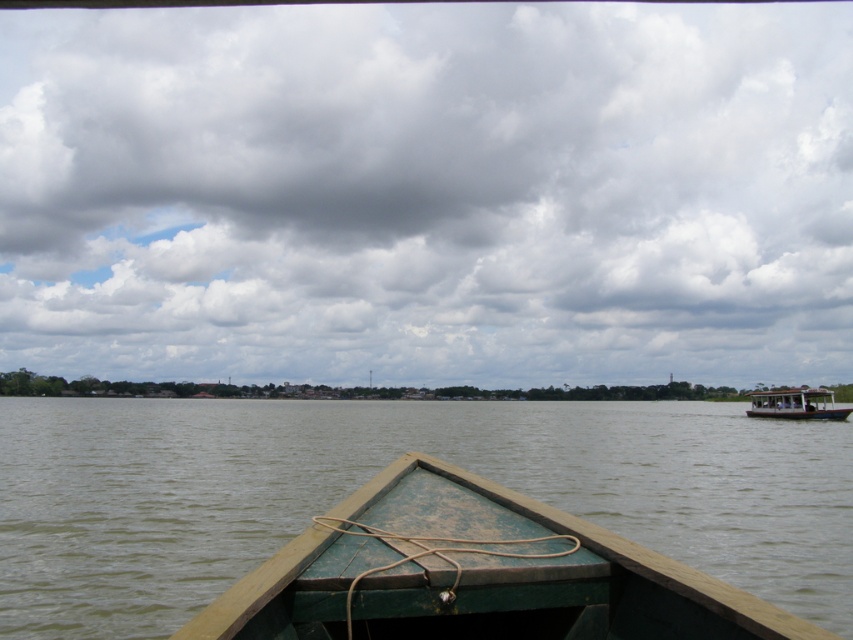
Question: Is cloudy sky at upper center wider than green weathered wood boat at center?

Choices:
 (A) yes
 (B) no

Answer: (A)

Question: Among these points, which one is farthest from the camera?

Choices:
 (A) (746, 620)
 (B) (758, 396)
 (C) (762, 147)

Answer: (C)

Question: Among these points, which one is nearest to the camera?

Choices:
 (A) (753, 627)
 (B) (805, 394)
 (C) (105, 372)

Answer: (A)

Question: Does cloudy sky at upper center appear on the right side of green weathered wood boat at center?

Choices:
 (A) yes
 (B) no

Answer: (B)

Question: Is green weathered wood boat at center above white wooden boat at right?

Choices:
 (A) yes
 (B) no

Answer: (A)

Question: Which object appears closest to the camera in this image?

Choices:
 (A) cloudy sky at upper center
 (B) white wooden boat at right
 (C) green weathered wood boat at center

Answer: (C)